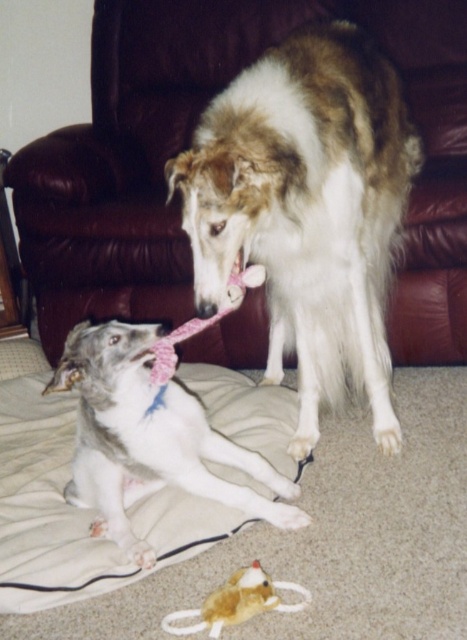
Question: Which point is farther from the camera taking this photo?

Choices:
 (A) (167, 369)
 (B) (115, 333)

Answer: (A)

Question: Which object appears farthest from the camera in this image?

Choices:
 (A) pink fabric neckband at center
 (B) white fur dog at center
 (C) white fur dog at lower left
 (D) fuzzy brown plush mouse at lower center

Answer: (A)

Question: Can you confirm if white fur dog at lower left is positioned to the right of pink fabric neckband at center?

Choices:
 (A) no
 (B) yes

Answer: (A)

Question: Which point appears farthest from the camera in this image?

Choices:
 (A) (197, 611)
 (B) (62, 384)
 (C) (322, 337)
 (D) (112, 188)

Answer: (D)

Question: Is white fur dog at lower left wider than pink fabric neckband at center?

Choices:
 (A) no
 (B) yes

Answer: (B)

Question: Can you confirm if brown leather armchair at upper center is positioned to the left of white fur dog at lower left?

Choices:
 (A) no
 (B) yes

Answer: (A)